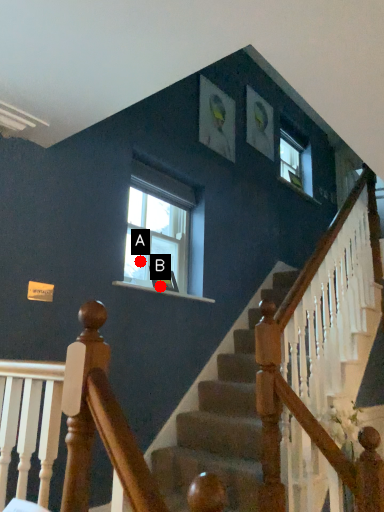
Question: Two points are circled on the image, labeled by A and B beside each circle. Which of the following is the farthest from the observer?

Choices:
 (A) A is further
 (B) B is further

Answer: (A)